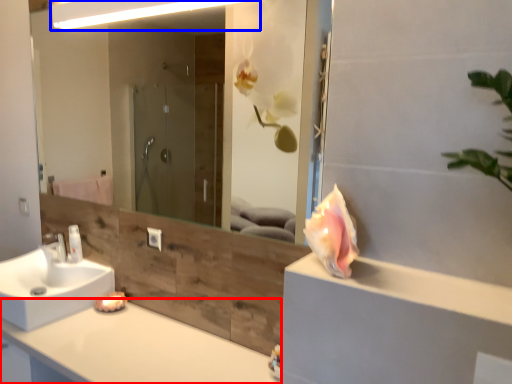
Question: Which object is closer to the camera taking this photo, countertop (highlighted by a red box) or light fixture (highlighted by a blue box)?

Choices:
 (A) countertop
 (B) light fixture

Answer: (A)